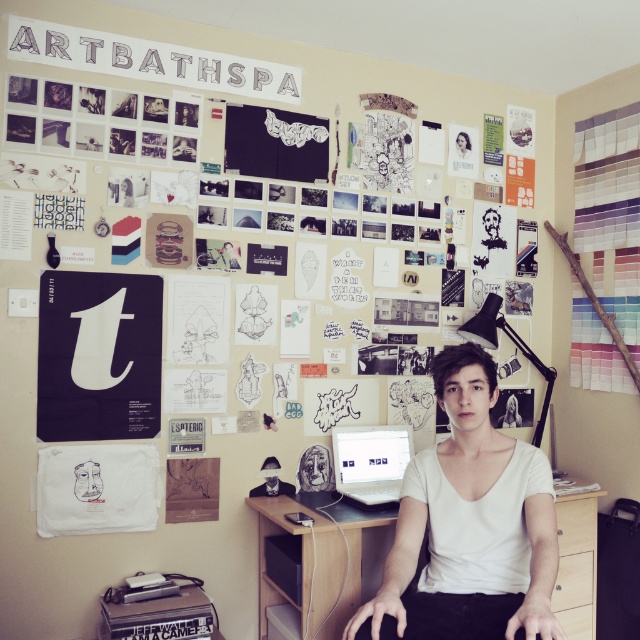
From the picture: Is wooden at center to the left of satin silver laptop at center from the viewer's perspective?

Indeed, wooden at center is positioned on the left side of satin silver laptop at center.

Identify the location of wooden at center. Image resolution: width=640 pixels, height=640 pixels. (300, 556).

At what (x,y) coordinates should I click in order to perform the action: click on wooden at center. Please return your answer as a coordinate pair (x, y). The height and width of the screenshot is (640, 640). Looking at the image, I should click on (300, 556).

Between white cotton shirt at center and wooden at center, which one appears on the left side from the viewer's perspective?

wooden at center

Does white cotton shirt at center have a lesser height compared to wooden at center?

In fact, white cotton shirt at center may be taller than wooden at center.

Does point (449, 378) lie behind point (390, 540)?

No, (449, 378) is closer to viewer.

I want to click on white cotton shirt at center, so click(468, 525).

Which of these two, white cotton shirt at center or satin silver laptop at center, stands shorter?

Standing shorter between the two is satin silver laptop at center.

This screenshot has height=640, width=640. In order to click on white cotton shirt at center in this screenshot , I will do `click(468, 525)`.

You are a GUI agent. You are given a task and a screenshot of the screen. Output one action in this format:
    pyautogui.click(x=<x>, y=<y>)
    Task: Click on the white cotton shirt at center
    This screenshot has height=640, width=640.
    Given the screenshot: What is the action you would take?
    pyautogui.click(x=468, y=525)